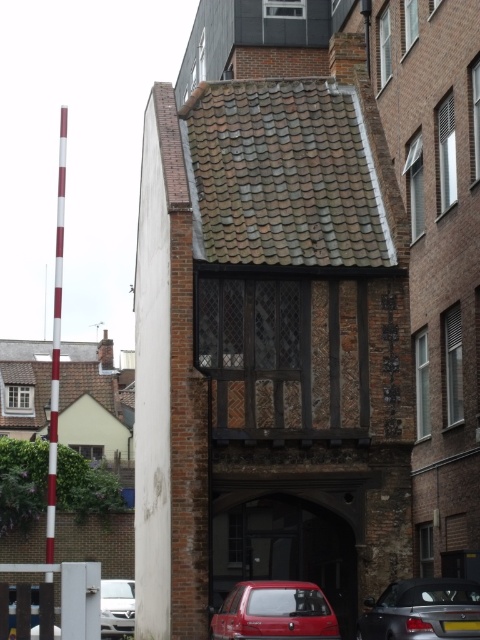
Question: Is metallic red car at center positioned at the back of shiny black convertible at lower right?

Choices:
 (A) no
 (B) yes

Answer: (B)

Question: Which object appears closest to the camera in this image?

Choices:
 (A) metallic red car at center
 (B) white glossy car at lower left

Answer: (B)

Question: Which point is farther to the camera?

Choices:
 (A) metallic red car at center
 (B) matte red car at lower center
 (C) white glossy car at lower left

Answer: (A)

Question: Is shiny black convertible at lower right to the left of matte red car at lower center from the viewer's perspective?

Choices:
 (A) no
 (B) yes

Answer: (A)

Question: Does metallic red car at center come behind shiny black convertible at lower right?

Choices:
 (A) yes
 (B) no

Answer: (A)

Question: Which of the following is the farthest from the observer?

Choices:
 (A) metallic red car at center
 (B) shiny black convertible at lower right

Answer: (A)